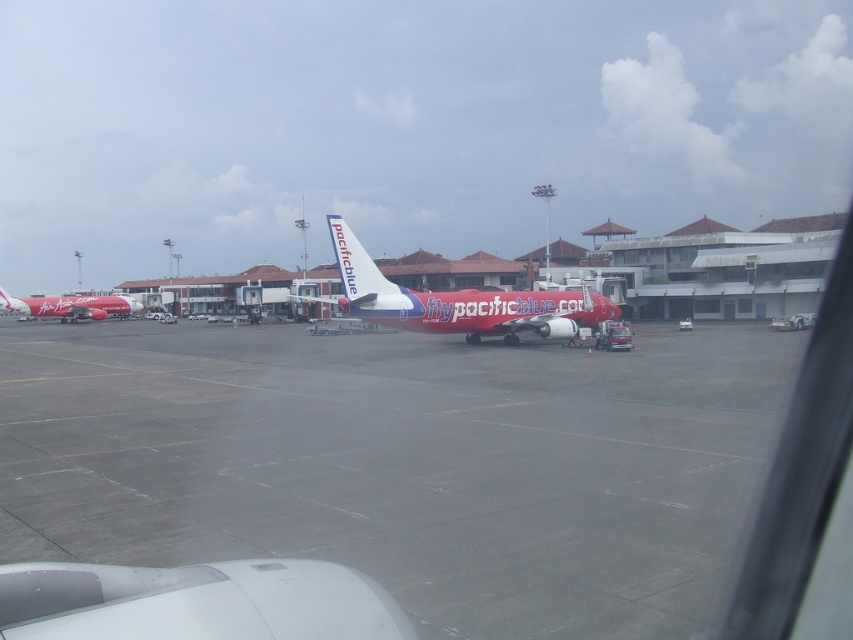
You are a pilot preparing to taxi your aircraft. You need to determine if your plane, which is the same length as the matte red airplane at left, can fit entirely on the gray asphalt runway at center without overhanging. Based on the scene, what should you conclude?

The gray asphalt runway at center is shorter than the matte red airplane at left, so your plane cannot fit entirely on the gray asphalt runway at center without overhanging.

You are a pilot preparing to taxi your aircraft. You need to navigate between the gray asphalt runway at center and the matte red airplane at center. Which path is wider?

The gray asphalt runway at center is wider than the matte red airplane at center.